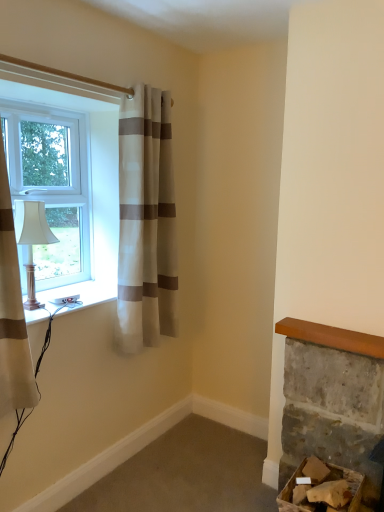
Question: Does cardboard box at lower right have a greater height compared to matte white lamp at left?

Choices:
 (A) no
 (B) yes

Answer: (A)

Question: Would you say cardboard box at lower right contains matte white lamp at left?

Choices:
 (A) no
 (B) yes

Answer: (A)

Question: Considering the relative positions of cardboard box at lower right and matte white lamp at left in the image provided, is cardboard box at lower right in front of matte white lamp at left?

Choices:
 (A) yes
 (B) no

Answer: (A)

Question: Is cardboard box at lower right bigger than matte white lamp at left?

Choices:
 (A) no
 (B) yes

Answer: (B)

Question: Is cardboard box at lower right turned away from matte white lamp at left?

Choices:
 (A) no
 (B) yes

Answer: (A)

Question: Do you think white striped curtain at upper left, the first curtain viewed from the back, is within matte white lamp at left, or outside of it?

Choices:
 (A) inside
 (B) outside

Answer: (B)

Question: From a real-world perspective, is white striped curtain at upper left, acting as the first curtain starting from the right, physically located above or below matte white lamp at left?

Choices:
 (A) above
 (B) below

Answer: (A)

Question: In terms of height, does white striped curtain at upper left, acting as the second curtain starting from the left, look taller or shorter compared to matte white lamp at left?

Choices:
 (A) tall
 (B) short

Answer: (A)

Question: In the image, is white striped curtain at upper left, acting as the second curtain starting from the left, positioned in front of or behind matte white lamp at left?

Choices:
 (A) behind
 (B) front

Answer: (A)

Question: From a real-world perspective, is matte white lamp at left physically located above or below white striped curtain at left, which appears as the second curtain when viewed from the back?

Choices:
 (A) below
 (B) above

Answer: (A)

Question: Considering the positions of matte white lamp at left and white striped curtain at left, the 2th curtain viewed from the right, in the image, is matte white lamp at left taller or shorter than white striped curtain at left, the 2th curtain viewed from the right,?

Choices:
 (A) tall
 (B) short

Answer: (B)

Question: Is matte white lamp at left in front of or behind white striped curtain at left, which is the first curtain from left to right, in the image?

Choices:
 (A) front
 (B) behind

Answer: (B)

Question: Considering the positions of matte white lamp at left and white striped curtain at left, which is the first curtain from left to right, in the image, is matte white lamp at left bigger or smaller than white striped curtain at left, which is the first curtain from left to right,?

Choices:
 (A) big
 (B) small

Answer: (B)

Question: In terms of size, does matte white lamp at left appear bigger or smaller than cardboard box at lower right?

Choices:
 (A) big
 (B) small

Answer: (B)

Question: Considering the positions of matte white lamp at left and cardboard box at lower right in the image, is matte white lamp at left taller or shorter than cardboard box at lower right?

Choices:
 (A) tall
 (B) short

Answer: (A)